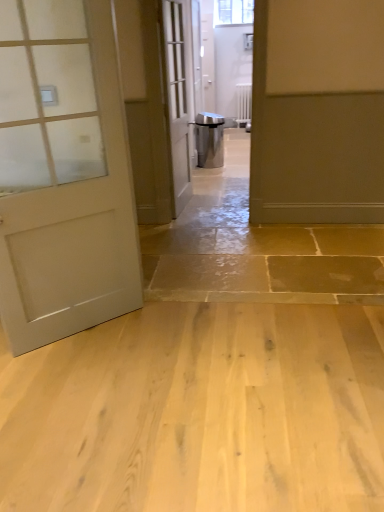
Where is `free spot above light brown wood flooring at center (from a real-world perspective)`? Image resolution: width=384 pixels, height=512 pixels. free spot above light brown wood flooring at center (from a real-world perspective) is located at coordinates (191, 386).